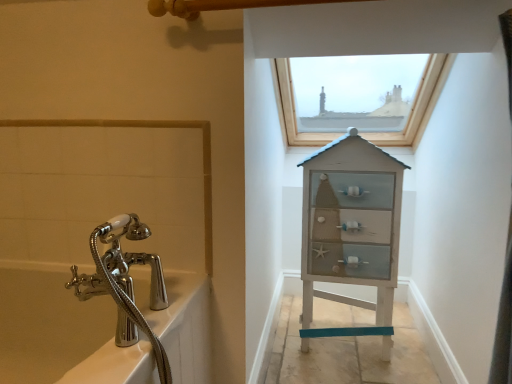
Question: Does polished chrome bath at left have a greater width compared to white wood cabinet at center?

Choices:
 (A) yes
 (B) no

Answer: (A)

Question: Could white wood cabinet at center be considered to be inside polished chrome bath at left?

Choices:
 (A) no
 (B) yes

Answer: (A)

Question: Does polished chrome bath at left have a lesser width compared to white wood cabinet at center?

Choices:
 (A) no
 (B) yes

Answer: (A)

Question: From the image's perspective, does polished chrome bath at left appear higher than white wood cabinet at center?

Choices:
 (A) no
 (B) yes

Answer: (A)

Question: Is polished chrome bath at left smaller than white wood cabinet at center?

Choices:
 (A) yes
 (B) no

Answer: (B)

Question: Is polished chrome bath at left with white wood cabinet at center?

Choices:
 (A) yes
 (B) no

Answer: (B)

Question: Can you see white wood cabinet at center touching polished chrome bath at left?

Choices:
 (A) yes
 (B) no

Answer: (B)

Question: From the image's perspective, does white wood cabinet at center appear higher than polished chrome bath at left?

Choices:
 (A) no
 (B) yes

Answer: (B)

Question: Is the position of white wood cabinet at center less distant than that of polished chrome bath at left?

Choices:
 (A) yes
 (B) no

Answer: (B)

Question: Does white wood cabinet at center lie behind polished chrome bath at left?

Choices:
 (A) yes
 (B) no

Answer: (A)

Question: From a real-world perspective, is white wood cabinet at center beneath polished chrome bath at left?

Choices:
 (A) no
 (B) yes

Answer: (A)

Question: Is white wood cabinet at center oriented towards polished chrome bath at left?

Choices:
 (A) yes
 (B) no

Answer: (B)

Question: Is wooden frame window at upper center at the right side of white wood cabinet at center?

Choices:
 (A) yes
 (B) no

Answer: (A)